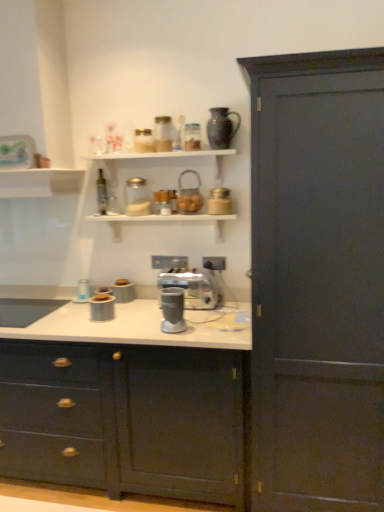
Question: Considering the relative sizes of matte black vase at upper center and matte dark wood cabinet at right, marked as the 1th cabinetry in a right-to-left arrangement, in the image provided, is matte black vase at upper center taller than matte dark wood cabinet at right, marked as the 1th cabinetry in a right-to-left arrangement,?

Choices:
 (A) yes
 (B) no

Answer: (B)

Question: From a real-world perspective, is matte black vase at upper center on matte dark wood cabinet at right, the 2th cabinetry positioned from the left?

Choices:
 (A) no
 (B) yes

Answer: (B)

Question: Is the surface of matte black vase at upper center in direct contact with matte dark wood cabinet at right, marked as the 1th cabinetry in a right-to-left arrangement?

Choices:
 (A) yes
 (B) no

Answer: (B)

Question: Can we say matte black vase at upper center lies outside matte dark wood cabinet at right, the 2th cabinetry positioned from the left?

Choices:
 (A) yes
 (B) no

Answer: (A)

Question: Is matte black vase at upper center wider than matte dark wood cabinet at right, the 2th cabinetry positioned from the left?

Choices:
 (A) no
 (B) yes

Answer: (A)

Question: Considering the positions of satin silver coffee machine at center and matte dark blue cabinet at center, positioned as the 2th cabinetry in right-to-left order, in the image, is satin silver coffee machine at center wider or thinner than matte dark blue cabinet at center, positioned as the 2th cabinetry in right-to-left order,?

Choices:
 (A) thin
 (B) wide

Answer: (A)

Question: In terms of height, does satin silver coffee machine at center look taller or shorter compared to matte dark blue cabinet at center, positioned as the 2th cabinetry in right-to-left order?

Choices:
 (A) short
 (B) tall

Answer: (A)

Question: Looking at the image, does satin silver coffee machine at center seem bigger or smaller compared to matte dark blue cabinet at center, arranged as the 1th cabinetry when viewed from the left?

Choices:
 (A) big
 (B) small

Answer: (B)

Question: Is satin silver coffee machine at center spatially inside matte dark blue cabinet at center, positioned as the 2th cabinetry in right-to-left order, or outside of it?

Choices:
 (A) inside
 (B) outside

Answer: (A)

Question: From the image's perspective, is translucent glass basket at upper center, positioned as the fourth appliance in left-to-right order, above or below matte dark blue cabinet at center, arranged as the 1th cabinetry when viewed from the left?

Choices:
 (A) above
 (B) below

Answer: (A)

Question: Looking at the image, does translucent glass basket at upper center, positioned as the 1th appliance in top-to-bottom order, seem bigger or smaller compared to matte dark blue cabinet at center, arranged as the 1th cabinetry when viewed from the left?

Choices:
 (A) small
 (B) big

Answer: (A)

Question: From a real-world perspective, is translucent glass basket at upper center, positioned as the 2th appliance in right-to-left order, above or below matte dark blue cabinet at center, positioned as the 2th cabinetry in right-to-left order?

Choices:
 (A) above
 (B) below

Answer: (A)

Question: Is translucent glass basket at upper center, acting as the fifth appliance starting from the bottom, taller or shorter than matte dark blue cabinet at center, arranged as the 1th cabinetry when viewed from the left?

Choices:
 (A) tall
 (B) short

Answer: (B)

Question: Looking at their shapes, would you say metallic silver blender at center is wider or thinner than satin silver coffee machine at center?

Choices:
 (A) thin
 (B) wide

Answer: (B)

Question: From a real-world perspective, is metallic silver blender at center positioned above or below satin silver coffee machine at center?

Choices:
 (A) below
 (B) above

Answer: (B)